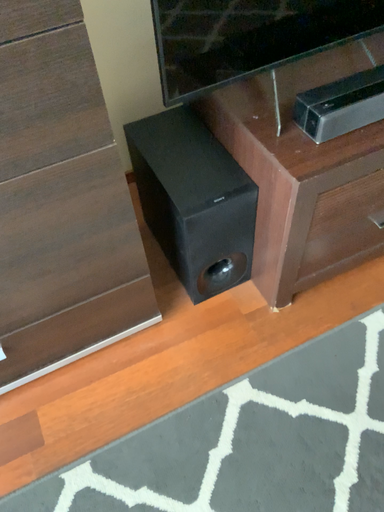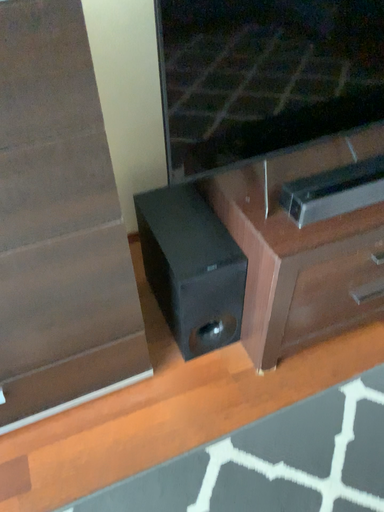
Question: How did the camera likely rotate when shooting the video?

Choices:
 (A) rotated downward
 (B) rotated upward

Answer: (B)